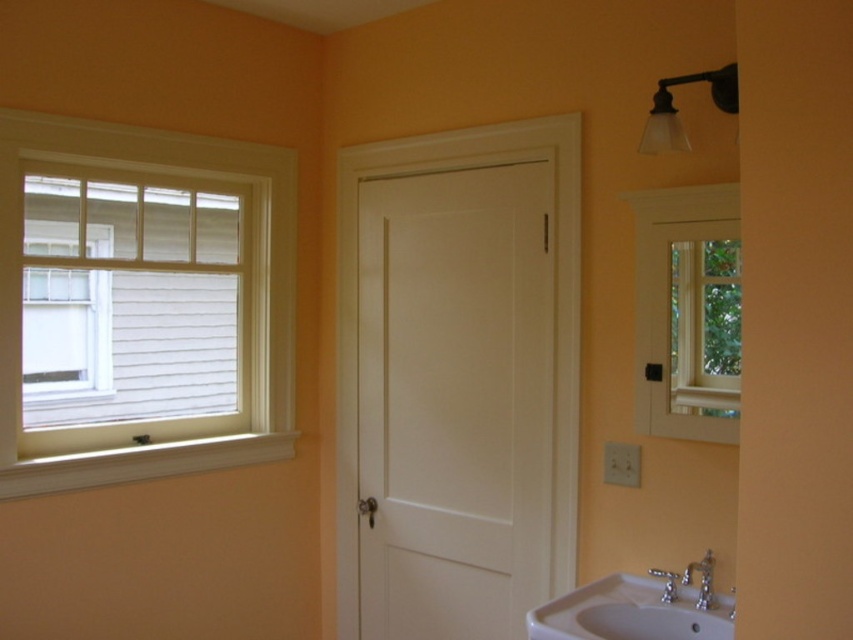
You are standing in the bathroom and want to open the window to let in some fresh air. Which object, the white painted wood window at left or the white porcelain sink at lower right, is closer to you so you can reach it easily?

The white painted wood window at left is closer to you than the white porcelain sink at lower right, so you can reach it easily.

You are designing a bathroom renovation and need to decide where to place a new plant. The plant requires a spot near a window to get sunlight. Which window should you choose between the white painted wood window at left and the white wood window at upper right?

The white painted wood window at left has a larger size compared to the white wood window at upper right, so it likely provides more sunlight for the plant.